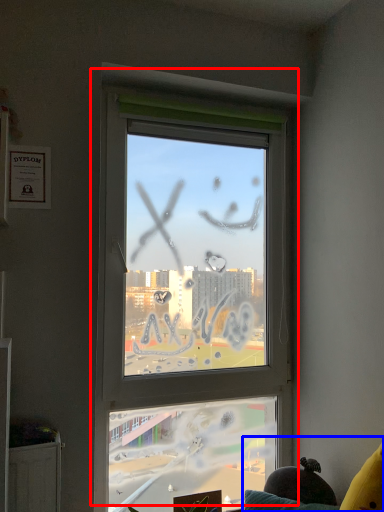
Question: Among these objects, which one is farthest to the camera, window (highlighted by a red box) or couch (highlighted by a blue box)?

Choices:
 (A) window
 (B) couch

Answer: (A)